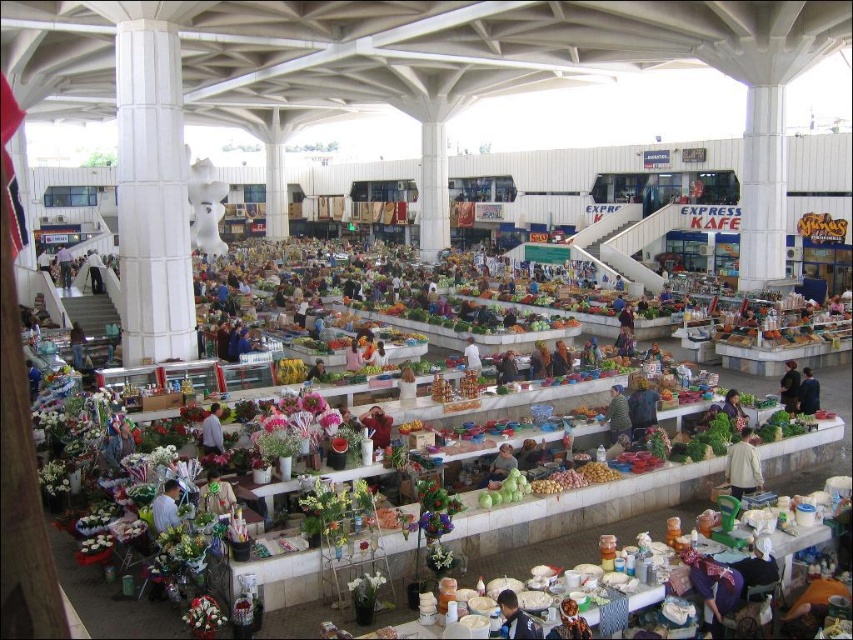
You are a customer in the market and want to find the blue fabric shirt at center. According to the coordinates provided, where should you look to find it?

The blue fabric shirt at center is located at coordinates point (166, 508).

You are a customer standing at the entrance of the market and see the blue denim jacket at lower center and the smooth beige shirt at center. Which item is closer to you?

The blue denim jacket at lower center is 26.71 meters away from the smooth beige shirt at center. Since the blue denim jacket is at lower center and the smooth beige shirt is at center, the smooth beige shirt at center is closer to you.

You are a customer at the market and want to reach the smooth beige shirt at center to try it on. However, there is a blue denim jacket at lower center blocking your path. Can you walk around the jacket to get to the shirt?

The blue denim jacket at lower center is in front of the smooth beige shirt at center, so you can walk around the jacket to access the shirt since it is blocking the direct path but not the entire area.